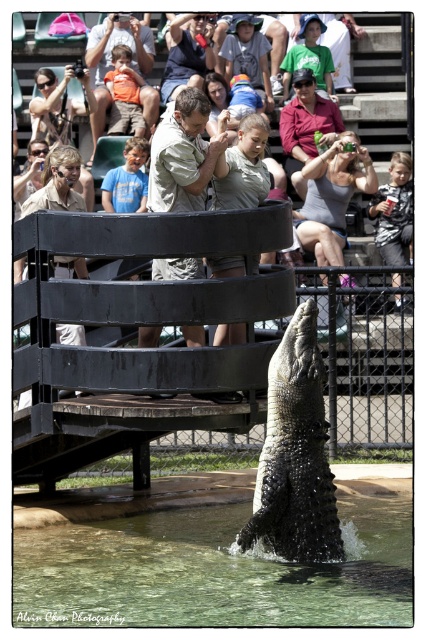
In the scene shown: You are standing at the point with coordinates 0.5, 0.5 in the image. You want to reach the clear water at lower center. Which direction should you move to get there?

The clear water at lower center is located at point [213,570]. Since you are at [213,320], you should move to the right to reach it.

You are a visitor at the zoo and you see the shiny black crocodile at center and the khaki cotton shirt at upper center. Which object is positioned higher in the image?

The khaki cotton shirt at upper center is positioned higher in the image than the shiny black crocodile at center.

You are a visitor at the zoo and want to take a photo of the clear water at lower center while avoiding the light brown leather jacket at upper center in the background. Which direction should you move to ensure the jacket is out of frame?

Move to the left to position the clear water at lower center away from the light brown leather jacket at upper center, as the water is to the right of the jacket.